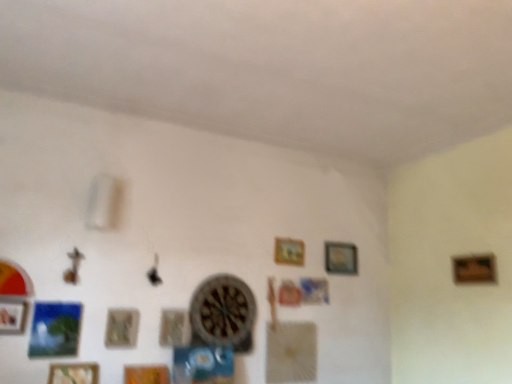
What are the coordinates of `wooden textured picture frame at lower left, which is the 3th picture frame in left-to-right order` in the screenshot? It's located at 122,328.

You are a GUI agent. You are given a task and a screenshot of the screen. Output one action in this format:
    pyautogui.click(x=<x>, y=<y>)
    Task: Click on the wooden picture frame at lower center, which ranks as the fifth picture frame in right-to-left order
    
    Given the screenshot: What is the action you would take?
    [x=146, y=374]

Describe the element at coordinates (174, 328) in the screenshot. This screenshot has height=384, width=512. I see `wooden picture frame at center, positioned as the fifth picture frame in left-to-right order` at that location.

Find the location of a particular element. The width and height of the screenshot is (512, 384). wooden textured picture frame at lower left, which is the 3th picture frame in left-to-right order is located at coordinates (122, 328).

Which of these two, wooden picture frame at lower left, the 2th picture frame positioned from the left, or wooden clock at center, is bigger?

wooden clock at center.

Considering the positions of objects wooden picture frame at lower left, placed as the seventh picture frame when sorted from right to left, and wooden clock at center in the image provided, who is in front, wooden picture frame at lower left, placed as the seventh picture frame when sorted from right to left, or wooden clock at center?

wooden picture frame at lower left, placed as the seventh picture frame when sorted from right to left, is in front.

From a real-world perspective, which is physically above, wooden picture frame at lower left, the 2th picture frame positioned from the left, or wooden clock at center?

In real-world perspective, wooden clock at center is above.

Based on the photo, does wooden picture frame at lower left, placed as the seventh picture frame when sorted from right to left, have a greater height compared to wooden clock at center?

No, wooden picture frame at lower left, placed as the seventh picture frame when sorted from right to left, is not taller than wooden clock at center.

Considering the points (297, 240) and (128, 313), which point is behind, point (297, 240) or point (128, 313)?

The point (297, 240) is farther from the camera.

Considering the positions of objects wooden frame at center, which appears as the 6th picture frame when viewed from the left, and wooden textured picture frame at lower left, which is the 3th picture frame in left-to-right order, in the image provided, who is more to the left, wooden frame at center, which appears as the 6th picture frame when viewed from the left, or wooden textured picture frame at lower left, which is the 3th picture frame in left-to-right order,?

wooden textured picture frame at lower left, which is the 3th picture frame in left-to-right order, is more to the left.

Does wooden frame at right, the 8th picture frame when ordered from left to right, come in front of wooden picture frame at center, positioned as the fifth picture frame in left-to-right order?

No.

Does point (485, 277) come behind point (162, 321)?

Yes, point (485, 277) is farther from viewer.

Is wooden frame at right, the 1th picture frame in the right-to-left sequence, turned away from wooden picture frame at center, which is the 4th picture frame from right to left?

No, wooden frame at right, the 1th picture frame in the right-to-left sequence, is not facing away from wooden picture frame at center, which is the 4th picture frame from right to left.

Considering the relative sizes of wooden picture frame at lower left, the eighth picture frame from the right, and wooden frame at right, the 1th picture frame in the right-to-left sequence, in the image provided, is wooden picture frame at lower left, the eighth picture frame from the right, wider than wooden frame at right, the 1th picture frame in the right-to-left sequence,?

Yes.

Is wooden picture frame at lower left, the first picture frame from the left, to the left of wooden frame at right, the 1th picture frame in the right-to-left sequence, from the viewer's perspective?

Yes.

How many degrees apart are the facing directions of wooden picture frame at lower left, the eighth picture frame from the right, and wooden frame at right, the 1th picture frame in the right-to-left sequence?

There is a 91.6-degree angle between the facing directions of wooden picture frame at lower left, the eighth picture frame from the right, and wooden frame at right, the 1th picture frame in the right-to-left sequence.

Between point (1, 331) and point (494, 270), which one is positioned in front?

Point (1, 331)

Who is shorter, wooden frame at right, the 1th picture frame in the right-to-left sequence, or wooden picture frame at upper center, which is counted as the seventh picture frame, starting from the left?

wooden frame at right, the 1th picture frame in the right-to-left sequence, is shorter.

Looking at this image, from a real-world perspective, is wooden frame at right, the 1th picture frame in the right-to-left sequence, above or below wooden picture frame at upper center, which is counted as the seventh picture frame, starting from the left?

In terms of real-world spatial position, wooden frame at right, the 1th picture frame in the right-to-left sequence, is below wooden picture frame at upper center, which is counted as the seventh picture frame, starting from the left.

Looking at this image, from the image's perspective, is wooden frame at right, the 1th picture frame in the right-to-left sequence, on wooden picture frame at upper center, positioned as the 2th picture frame in right-to-left order?

Correct, wooden frame at right, the 1th picture frame in the right-to-left sequence, appears higher than wooden picture frame at upper center, positioned as the 2th picture frame in right-to-left order, in the image.

Are wooden frame at right, the 8th picture frame when ordered from left to right, and wooden picture frame at upper center, positioned as the 2th picture frame in right-to-left order, located far from each other?

No, wooden frame at right, the 8th picture frame when ordered from left to right, is not far away from wooden picture frame at upper center, positioned as the 2th picture frame in right-to-left order.

Which is in front, wooden picture frame at center, which is the 4th picture frame from right to left, or wooden textured picture frame at lower left, the sixth picture frame from the right?

wooden textured picture frame at lower left, the sixth picture frame from the right, is closer to the camera.

Can you confirm if wooden picture frame at center, which is the 4th picture frame from right to left, is positioned to the right of wooden textured picture frame at lower left, the sixth picture frame from the right?

Yes.

From the image's perspective, which is below, wooden picture frame at center, which is the 4th picture frame from right to left, or wooden textured picture frame at lower left, which is the 3th picture frame in left-to-right order?

wooden picture frame at center, which is the 4th picture frame from right to left, from the image's perspective.

From the image's perspective, is wooden picture frame at center, which is the 4th picture frame from right to left, located above or below wooden picture frame at upper center, which is counted as the seventh picture frame, starting from the left?

wooden picture frame at center, which is the 4th picture frame from right to left, is below wooden picture frame at upper center, which is counted as the seventh picture frame, starting from the left.

Is wooden picture frame at center, which is the 4th picture frame from right to left, taller than wooden picture frame at upper center, positioned as the 2th picture frame in right-to-left order?

No.

Considering the positions of objects wooden picture frame at center, positioned as the fifth picture frame in left-to-right order, and wooden picture frame at upper center, positioned as the 2th picture frame in right-to-left order, in the image provided, who is more to the left, wooden picture frame at center, positioned as the fifth picture frame in left-to-right order, or wooden picture frame at upper center, positioned as the 2th picture frame in right-to-left order,?

wooden picture frame at center, positioned as the fifth picture frame in left-to-right order, is more to the left.

Considering the points (164, 337) and (355, 269), which point is behind, point (164, 337) or point (355, 269)?

The point (355, 269) is farther.

In order to click on clock on the right of the wooden picture frame at lower left, placed as the seventh picture frame when sorted from right to left in this screenshot , I will do `click(223, 313)`.

From a real-world perspective, starting from the wooden frame at center, arranged as the third picture frame when viewed from the right, which picture frame is the 5th one below it? Please provide its 2D coordinates.

[(122, 328)]

From the image, which object appears to be nearer to wooden picture frame at center, which is the 4th picture frame from right to left, wooden picture frame at lower center, which appears as the fourth picture frame when viewed from the left, or wooden picture frame at upper center, positioned as the 2th picture frame in right-to-left order?

The object closer to wooden picture frame at center, which is the 4th picture frame from right to left, is wooden picture frame at lower center, which appears as the fourth picture frame when viewed from the left.

When comparing their distances from wooden frame at right, the 1th picture frame in the right-to-left sequence, does wooden picture frame at lower center, which appears as the fourth picture frame when viewed from the left, or wooden picture frame at lower left, placed as the seventh picture frame when sorted from right to left, seem closer?

wooden picture frame at lower center, which appears as the fourth picture frame when viewed from the left, is positioned closer to the anchor wooden frame at right, the 1th picture frame in the right-to-left sequence.

From the image, which object appears to be nearer to wooden textured picture frame at lower left, the sixth picture frame from the right, wooden picture frame at upper center, positioned as the 2th picture frame in right-to-left order, or wooden frame at right, the 1th picture frame in the right-to-left sequence?

Based on the image, wooden picture frame at upper center, positioned as the 2th picture frame in right-to-left order, appears to be nearer to wooden textured picture frame at lower left, the sixth picture frame from the right.

Estimate the real-world distances between objects in this image. Which object is further from wooden picture frame at lower left, the eighth picture frame from the right, wooden picture frame at lower center, which appears as the fourth picture frame when viewed from the left, or wooden frame at right, the 1th picture frame in the right-to-left sequence?

wooden frame at right, the 1th picture frame in the right-to-left sequence, is further to wooden picture frame at lower left, the eighth picture frame from the right.

Looking at the image, which one is located further to wooden picture frame at upper center, which is counted as the seventh picture frame, starting from the left, wooden frame at center, which appears as the 6th picture frame when viewed from the left, or wooden picture frame at center, which is the 4th picture frame from right to left?

wooden picture frame at center, which is the 4th picture frame from right to left, lies further to wooden picture frame at upper center, which is counted as the seventh picture frame, starting from the left, than the other object.

Based on their spatial positions, is wooden clock at center or wooden picture frame at upper center, which is counted as the seventh picture frame, starting from the left, further from wooden frame at center, which appears as the 6th picture frame when viewed from the left?

wooden clock at center.

Which object lies further to the anchor point wooden clock at center, wooden textured picture frame at lower left, the sixth picture frame from the right, or wooden picture frame at upper center, which is counted as the seventh picture frame, starting from the left?

wooden picture frame at upper center, which is counted as the seventh picture frame, starting from the left, lies further to wooden clock at center than the other object.

Based on their spatial positions, is wooden picture frame at center, which is the 4th picture frame from right to left, or wooden clock at center closer to wooden frame at right, the 1th picture frame in the right-to-left sequence?

wooden clock at center lies closer to wooden frame at right, the 1th picture frame in the right-to-left sequence, than the other object.

Locate an element on the screen. This screenshot has height=384, width=512. picture frame between wooden picture frame at lower left, the 2th picture frame positioned from the left, and wooden picture frame at lower center, which ranks as the fifth picture frame in right-to-left order is located at coordinates (122, 328).

The image size is (512, 384). What are the coordinates of `clock situated between wooden picture frame at lower left, the eighth picture frame from the right, and wooden frame at right, the 8th picture frame when ordered from left to right, from left to right` in the screenshot? It's located at (223, 313).

Where is `clock between wooden picture frame at center, positioned as the fifth picture frame in left-to-right order, and wooden picture frame at upper center, positioned as the 2th picture frame in right-to-left order`? The image size is (512, 384). clock between wooden picture frame at center, positioned as the fifth picture frame in left-to-right order, and wooden picture frame at upper center, positioned as the 2th picture frame in right-to-left order is located at coordinates (223, 313).

Identify the location of clock between wooden textured picture frame at lower left, which is the 3th picture frame in left-to-right order, and wooden frame at center, which appears as the 6th picture frame when viewed from the left, from left to right. Image resolution: width=512 pixels, height=384 pixels. (223, 313).